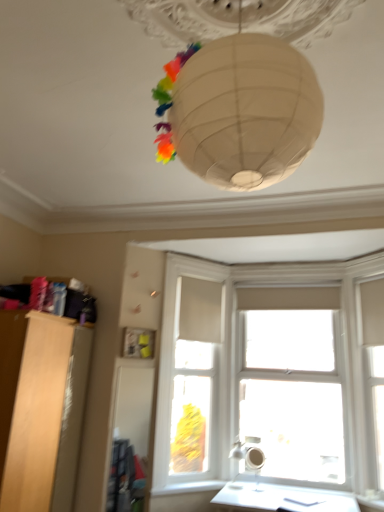
Question: Is light wood cabinet at left bigger than white smooth window sill at lower center?

Choices:
 (A) yes
 (B) no

Answer: (A)

Question: Does light wood cabinet at left have a greater width compared to white smooth window sill at lower center?

Choices:
 (A) no
 (B) yes

Answer: (B)

Question: Is white smooth window sill at lower center at the back of light wood cabinet at left?

Choices:
 (A) yes
 (B) no

Answer: (B)

Question: From the image's perspective, is light wood cabinet at left over white smooth window sill at lower center?

Choices:
 (A) no
 (B) yes

Answer: (B)

Question: Is light wood cabinet at left touching white smooth window sill at lower center?

Choices:
 (A) yes
 (B) no

Answer: (B)

Question: Is light wood cabinet at left behind white smooth window sill at lower center?

Choices:
 (A) no
 (B) yes

Answer: (A)

Question: From the image's perspective, is white wood window frame at center, marked as the first window frame in a left-to-right arrangement, on matte white lampshade at lower center?

Choices:
 (A) no
 (B) yes

Answer: (B)

Question: Is white wood window frame at center, marked as the first window frame in a left-to-right arrangement, far away from matte white lampshade at lower center?

Choices:
 (A) yes
 (B) no

Answer: (B)

Question: Does white wood window frame at center, marked as the first window frame in a left-to-right arrangement, contain matte white lampshade at lower center?

Choices:
 (A) no
 (B) yes

Answer: (A)

Question: From a real-world perspective, does white wood window frame at center, marked as the first window frame in a left-to-right arrangement, sit lower than matte white lampshade at lower center?

Choices:
 (A) no
 (B) yes

Answer: (A)

Question: Considering the relative sizes of white wood window frame at center, marked as the first window frame in a left-to-right arrangement, and matte white lampshade at lower center in the image provided, is white wood window frame at center, marked as the first window frame in a left-to-right arrangement, thinner than matte white lampshade at lower center?

Choices:
 (A) no
 (B) yes

Answer: (A)

Question: Is white wood window frame at center, arranged as the second window frame when viewed from the right, taller than matte white lampshade at lower center?

Choices:
 (A) no
 (B) yes

Answer: (B)

Question: From the image's perspective, is transparent glass window at center below white smooth window sill at lower center?

Choices:
 (A) yes
 (B) no

Answer: (B)